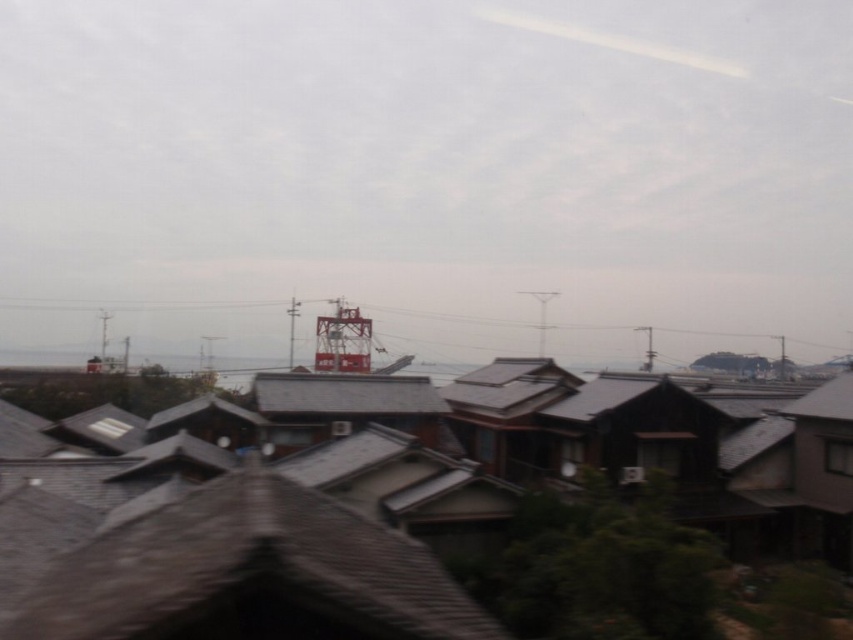
Looking at this image, you are a drone operator flying a drone over the residential area. You notice two points marked as point 1 at coordinates point [650,440] and point 2 at coordinates point [1,333]. Which point is closer to the drone when it is directly above the red structure with a white top?

Point [650,440] is in front of point [1,333], so the drone would be closer to point [650,440] when positioned above the red structure with a white top.

You are a drone operator trying to capture aerial footage of the gray tile roof at center and the metallic red tower at center. From your current position above the scene, which object is positioned lower in the frame?

The gray tile roof at center is located below the metallic red tower at center, so it is positioned lower in the frame.